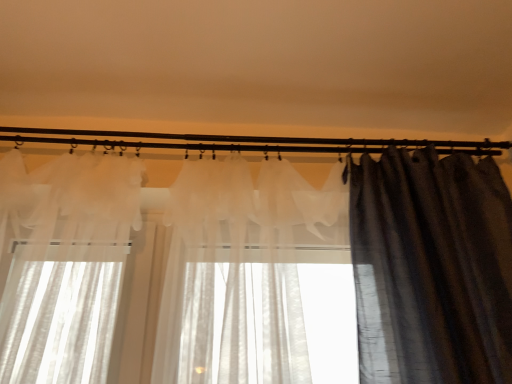
In order to face translucent fabric at center, should I rotate leftwards or rightwards?

Rotate your view right by about 1.412°.

Describe the element at coordinates (244, 142) in the screenshot. The width and height of the screenshot is (512, 384). I see `translucent fabric at center` at that location.

Where is `translucent fabric at center`? translucent fabric at center is located at coordinates (244, 142).

Identify the location of translucent fabric at center. (244, 142).